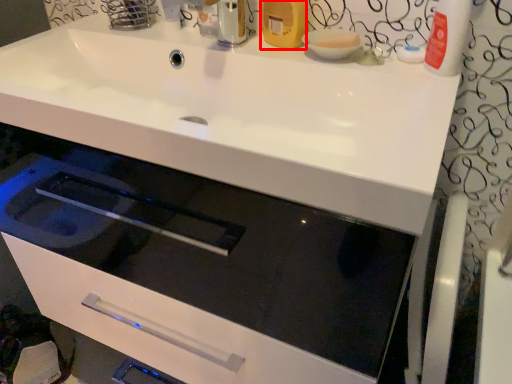
Question: Considering the relative positions of toiletry (annotated by the red box) and basin in the image provided, where is toiletry (annotated by the red box) located with respect to the staircase?

Choices:
 (A) left
 (B) right

Answer: (A)